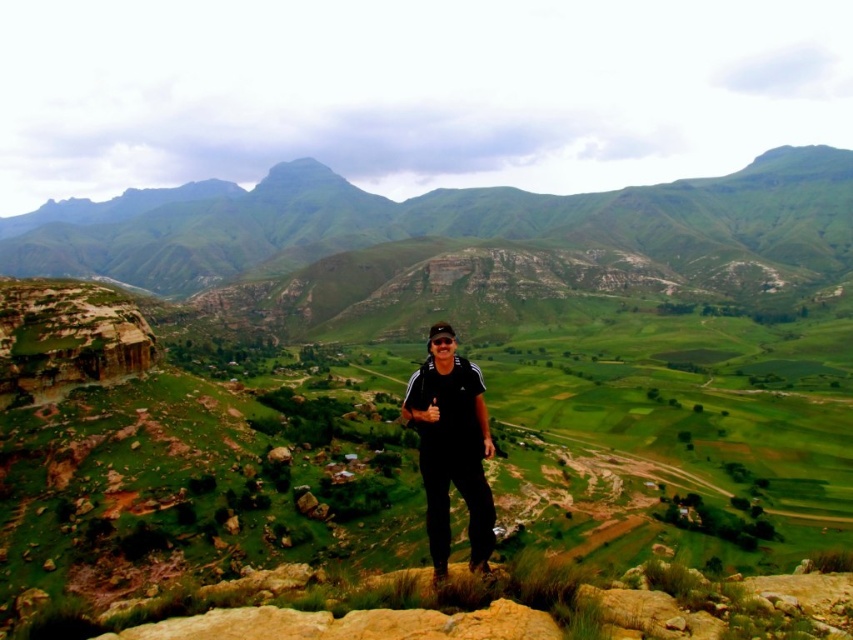
You are standing at the rocky outcrop in the foreground and want to reach the green grassy mountain at center. What direction should you head to reach it?

The green grassy mountain at center is located at point 0.378 on the x and 0.552 on the y coordinate, so you should head towards the center of the image to reach it.